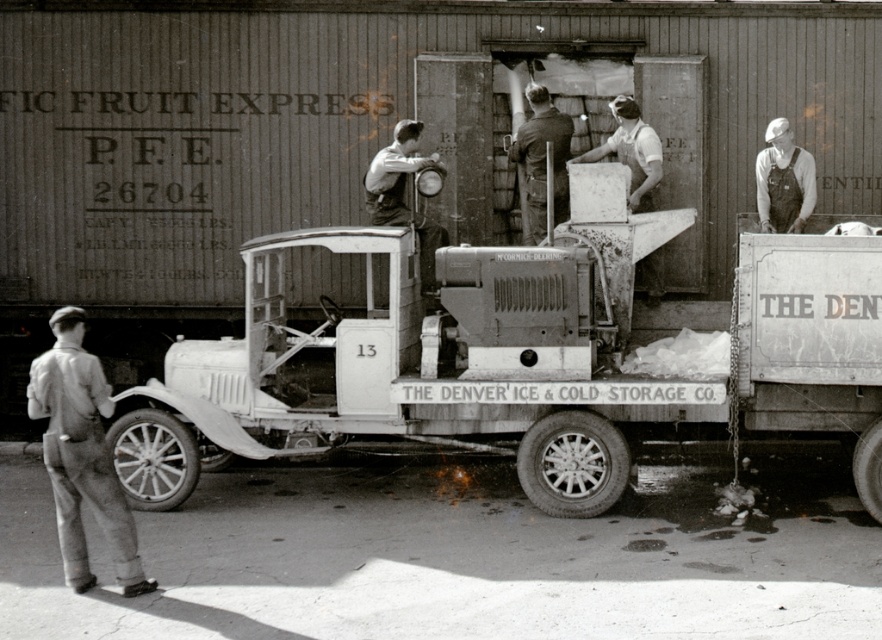
Between point (88, 477) and point (787, 168), which one is positioned behind?

The point (787, 168) is more distant.

Does light gray overalls at lower left have a greater width compared to overalls at center?

Correct, the width of light gray overalls at lower left exceeds that of overalls at center.

Describe the element at coordinates (81, 454) in the screenshot. Image resolution: width=882 pixels, height=640 pixels. I see `light gray overalls at lower left` at that location.

The height and width of the screenshot is (640, 882). Identify the location of light gray overalls at lower left. 81,454.

Is metallic white trailer truck at center wider than matte black overalls at center?

Correct, the width of metallic white trailer truck at center exceeds that of matte black overalls at center.

Which is in front, point (842, 289) or point (378, 182)?

Positioned in front is point (842, 289).

The width and height of the screenshot is (882, 640). What do you see at coordinates (513, 365) in the screenshot? I see `metallic white trailer truck at center` at bounding box center [513, 365].

This screenshot has width=882, height=640. What are the coordinates of `metallic white trailer truck at center` in the screenshot? It's located at (513, 365).

Between light gray overalls at lower left and dark brown leather jacket at upper center, which one appears on the right side from the viewer's perspective?

dark brown leather jacket at upper center is more to the right.

Does light gray overalls at lower left appear on the left side of dark brown leather jacket at upper center?

Yes, light gray overalls at lower left is to the left of dark brown leather jacket at upper center.

I want to click on light gray overalls at lower left, so click(81, 454).